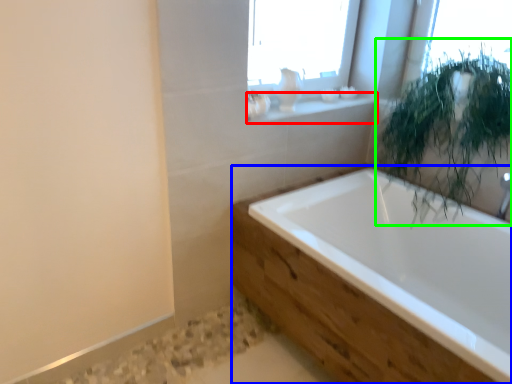
Question: Estimate the real-world distances between objects in this image. Which object is farther from window sill (highlighted by a red box), bathtub (highlighted by a blue box) or vegetation (highlighted by a green box)?

Choices:
 (A) bathtub
 (B) vegetation

Answer: (A)